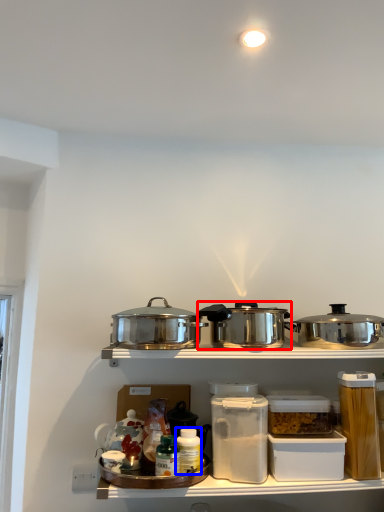
Question: Which object appears closest to the camera in this image, kitchen appliance (highlighted by a red box) or bottle (highlighted by a blue box)?

Choices:
 (A) kitchen appliance
 (B) bottle

Answer: (A)